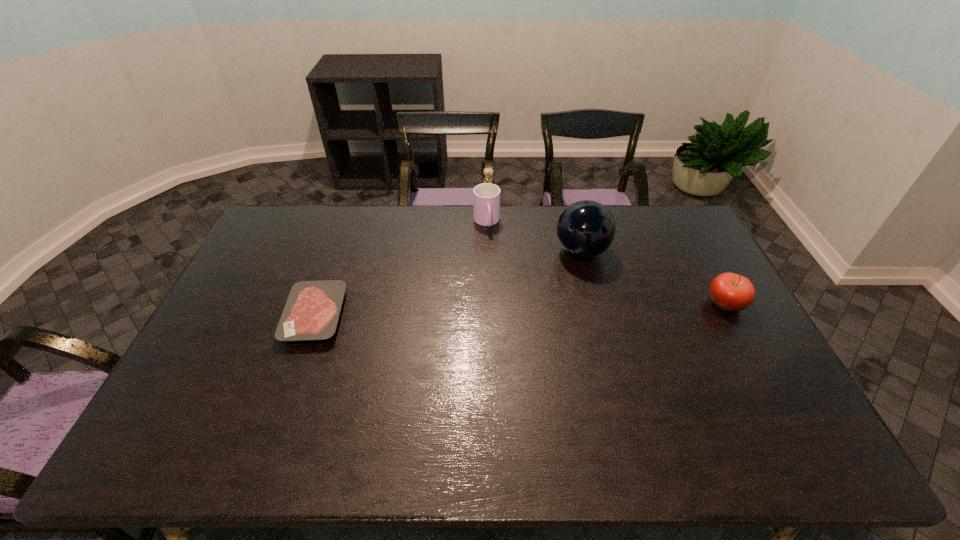
Where is `free space at the right edge of the desktop`? free space at the right edge of the desktop is located at coordinates [699, 287].

Find the location of a particular element. free spot at the far left corner of the desktop is located at coordinates (271, 228).

You are a GUI agent. You are given a task and a screenshot of the screen. Output one action in this format:
    pyautogui.click(x=<x>, y=<y>)
    Task: Click on the free space at the far right corner of the desktop
    
    Given the screenshot: What is the action you would take?
    pyautogui.click(x=668, y=225)

The width and height of the screenshot is (960, 540). Identify the location of free space that is in between the shortest object and the cup. (401, 269).

Locate an element on the screen. The image size is (960, 540). free spot between the rightmost object and the third object from right to left is located at coordinates (606, 263).

You are a GUI agent. You are given a task and a screenshot of the screen. Output one action in this format:
    pyautogui.click(x=<x>, y=<y>)
    Task: Click on the vacant area that lies between the tallest object and the cup
    The height and width of the screenshot is (540, 960).
    Given the screenshot: What is the action you would take?
    pyautogui.click(x=534, y=237)

The height and width of the screenshot is (540, 960). Find the location of `vacant space that's between the steak and the bowling ball`. vacant space that's between the steak and the bowling ball is located at coordinates (448, 284).

I want to click on blank region between the second object from left to right and the shortest object, so click(x=401, y=269).

This screenshot has width=960, height=540. What are the coordinates of `unoccupied position between the shortest object and the cup` in the screenshot? It's located at (401, 269).

This screenshot has height=540, width=960. In order to click on unoccupied area between the second object from left to right and the apple in this screenshot , I will do `click(606, 263)`.